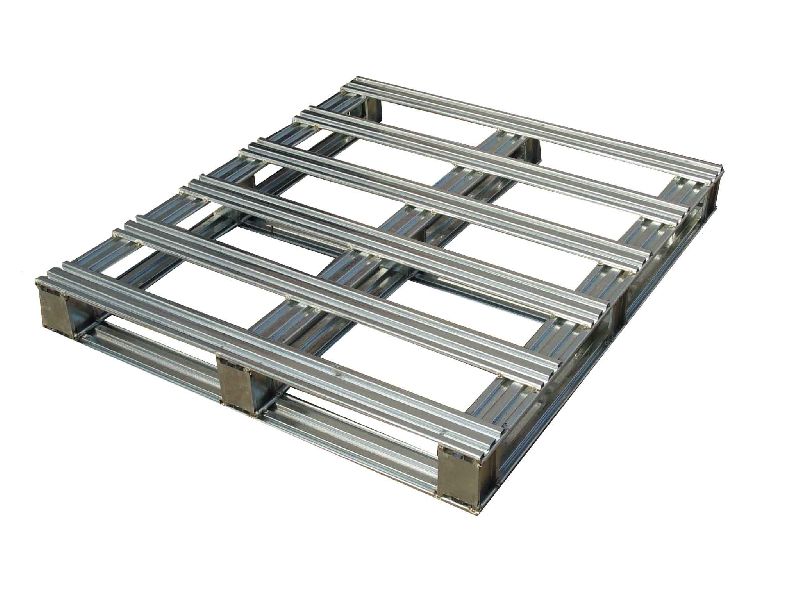
You are a GUI agent. You are given a task and a screenshot of the screen. Output one action in this format:
    pyautogui.click(x=<x>, y=<y>)
    Task: Click on the corners
    
    Given the screenshot: What is the action you would take?
    pyautogui.click(x=356, y=74), pyautogui.click(x=720, y=170), pyautogui.click(x=480, y=460), pyautogui.click(x=37, y=286)